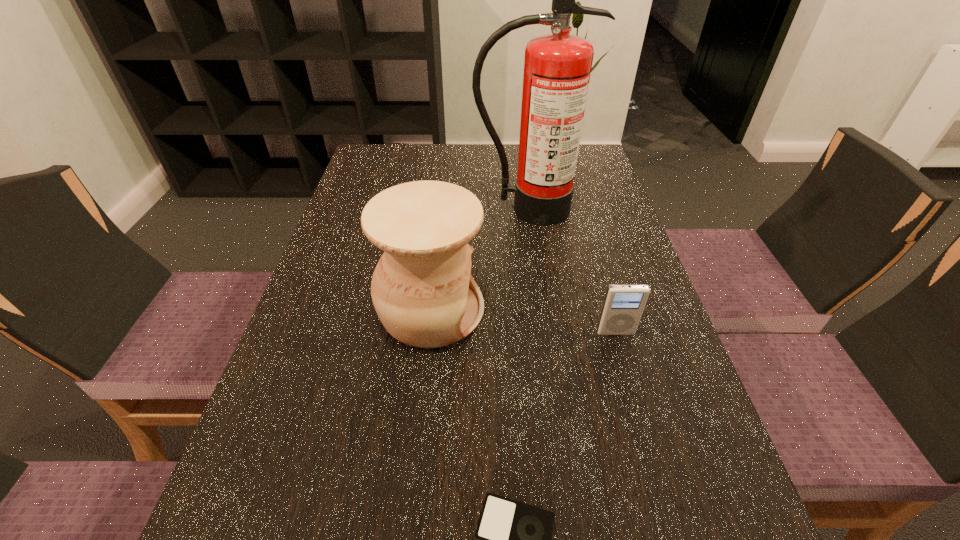
Where is `iPod located at the right edge`? iPod located at the right edge is located at coordinates (623, 306).

In the image, there is a desktop. At what (x,y) coordinates should I click in order to perform the action: click on vacant space at the far edge. Please return your answer as a coordinate pair (x, y). Looking at the image, I should click on (421, 173).

Where is `vacant position at the left edge of the desktop`? This screenshot has width=960, height=540. vacant position at the left edge of the desktop is located at coordinates (337, 227).

This screenshot has height=540, width=960. I want to click on vacant space at the right edge of the desktop, so click(x=577, y=217).

Locate an element on the screen. This screenshot has width=960, height=540. free space at the far left corner is located at coordinates (404, 152).

What are the coordinates of `empty space between the fire extinguisher and the third shortest object` in the screenshot? It's located at (479, 260).

Identify the location of unoccupied position between the tallest object and the second shortest object. This screenshot has height=540, width=960. click(x=571, y=271).

Where is `unoccupied area between the pottery and the second shortest object`? The width and height of the screenshot is (960, 540). unoccupied area between the pottery and the second shortest object is located at coordinates (523, 321).

Where is `vacant region between the pottery and the farthest object`? This screenshot has width=960, height=540. vacant region between the pottery and the farthest object is located at coordinates (479, 260).

Where is `free space between the pottery and the tallest object`? The image size is (960, 540). free space between the pottery and the tallest object is located at coordinates (479, 260).